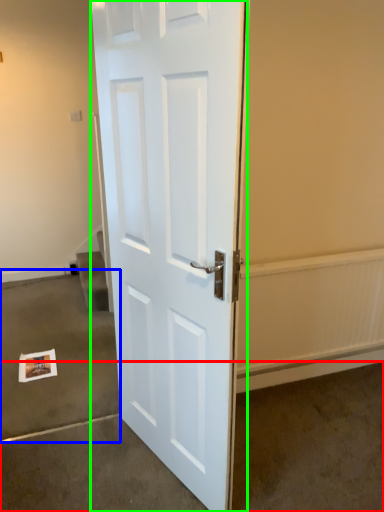
Question: Which is farther away from concrete (highlighted by a red box)? concrete (highlighted by a blue box) or door (highlighted by a green box)?

Choices:
 (A) concrete
 (B) door

Answer: (A)